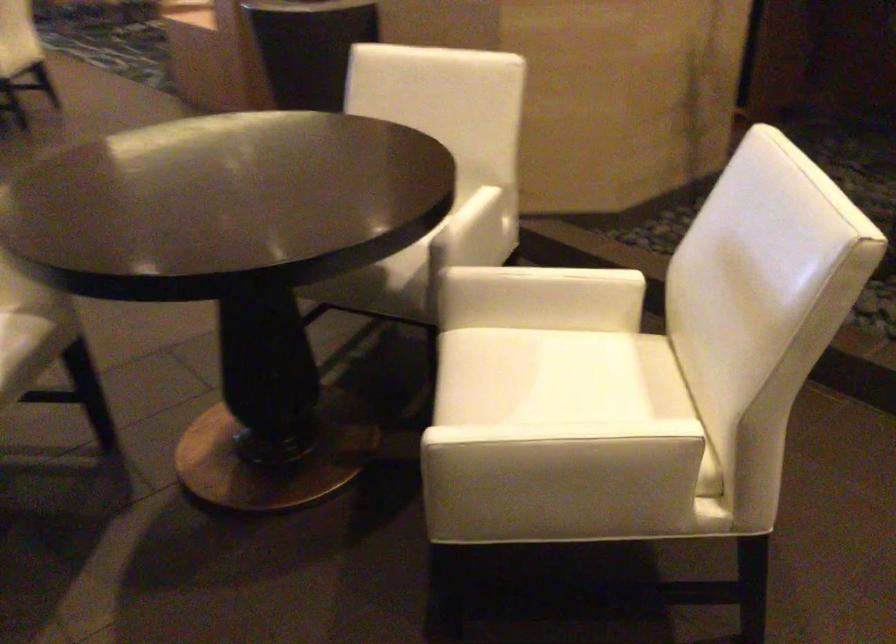
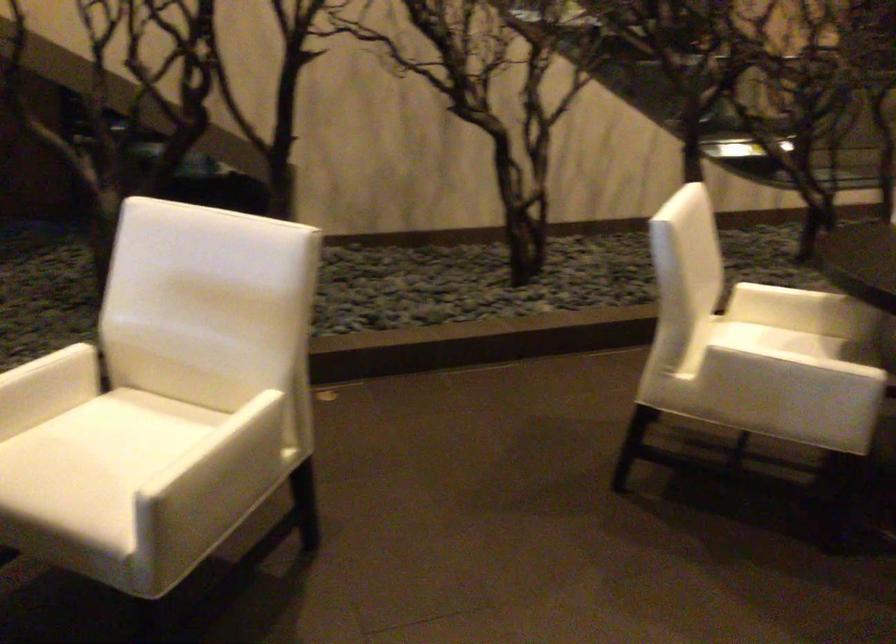
In the second image, find the point that corresponds to point 590,279 in the first image.

(58, 362)